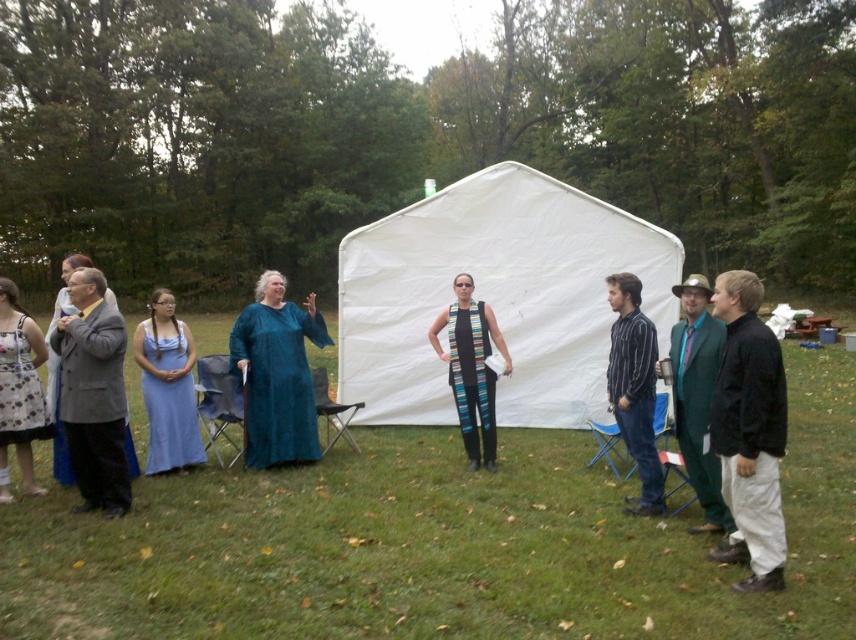
Is black matte jacket at lower right thinner than striped fabric vest at center?

Yes, black matte jacket at lower right is thinner than striped fabric vest at center.

Who is shorter, black matte jacket at lower right or striped fabric vest at center?

black matte jacket at lower right is shorter.

Who is more distant from viewer, (768, 499) or (485, 340)?

Point (485, 340)

Locate an element on the screen. black matte jacket at lower right is located at coordinates (749, 432).

Can you confirm if gray wool suit at left is thinner than green wool suit at right?

No.

Which of these two, gray wool suit at left or green wool suit at right, stands shorter?

With less height is green wool suit at right.

Does point (114, 368) come closer to viewer compared to point (722, 324)?

No, (114, 368) is further to viewer.

Locate an element on the screen. The image size is (856, 640). gray wool suit at left is located at coordinates pos(93,394).

In the scene shown: Does white fabric tent at center have a greater width compared to black matte jacket at lower right?

Correct, the width of white fabric tent at center exceeds that of black matte jacket at lower right.

Does white fabric tent at center have a smaller size compared to black matte jacket at lower right?

Incorrect, white fabric tent at center is not smaller in size than black matte jacket at lower right.

This screenshot has height=640, width=856. Describe the element at coordinates (495, 296) in the screenshot. I see `white fabric tent at center` at that location.

At what (x,y) coordinates should I click in order to perform the action: click on white fabric tent at center. Please return your answer as a coordinate pair (x, y). Looking at the image, I should click on (495, 296).